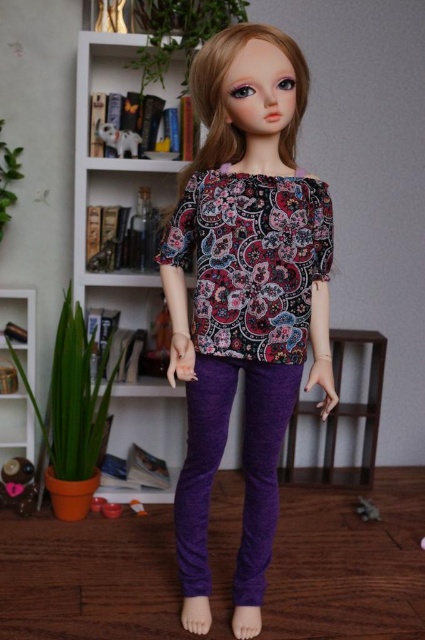
Question: Which point is farther from the camera taking this photo?

Choices:
 (A) (317, 182)
 (B) (17, 301)
 (C) (337, 333)
 (D) (164, 250)

Answer: (B)

Question: Is floral-patterned fabric blouse at center bigger than purple fabric stool at center?

Choices:
 (A) no
 (B) yes

Answer: (A)

Question: Which of the following is the closest to the observer?

Choices:
 (A) matte floral blouse at center
 (B) purple fabric stool at center

Answer: (A)

Question: Is matte floral blouse at center in front of floral-patterned fabric blouse at center?

Choices:
 (A) yes
 (B) no

Answer: (A)

Question: Which object is closer to the camera taking this photo?

Choices:
 (A) matte floral blouse at center
 (B) purple fabric stool at center
 (C) matte white bookshelf at left

Answer: (A)

Question: Does matte floral blouse at center appear over floral-patterned fabric blouse at center?

Choices:
 (A) no
 (B) yes

Answer: (A)